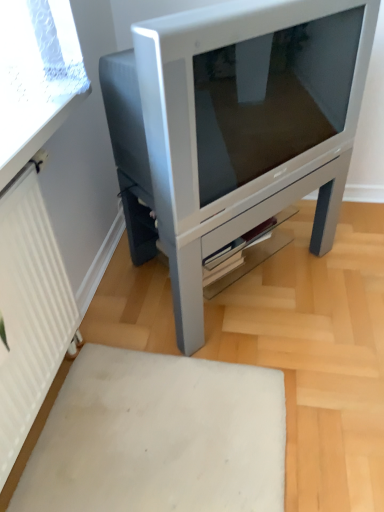
This screenshot has height=512, width=384. Describe the element at coordinates (159, 437) in the screenshot. I see `white matte rug at lower center` at that location.

Identify the location of satin silver television at center. (234, 128).

Is point (111, 121) closer to viewer compared to point (130, 417)?

No, (111, 121) is behind (130, 417).

Which is more to the left, satin silver television at center or white matte rug at lower center?

white matte rug at lower center.

At what (x,y) coordinates should I click in order to perform the action: click on furniture on the right of white matte rug at lower center. Please return your answer as a coordinate pair (x, y). The width and height of the screenshot is (384, 512). Looking at the image, I should click on (234, 128).

Based on the photo, between white ribbed radiator at left and white matte rug at lower center, which one has less height?

white matte rug at lower center is shorter.

Identify the location of plain behind the white ribbed radiator at left. (159, 437).

Does white ribbed radiator at left have a greater width compared to white matte rug at lower center?

No, white ribbed radiator at left is not wider than white matte rug at lower center.

Considering the positions of objects white ribbed radiator at left and white matte rug at lower center in the image provided, who is in front, white ribbed radiator at left or white matte rug at lower center?

white ribbed radiator at left is closer to the camera.

From the image's perspective, does white matte rug at lower center appear lower than white ribbed radiator at left?

Yes, from the image's perspective, white matte rug at lower center is beneath white ribbed radiator at left.

Consider the image. Is white matte rug at lower center taller or shorter than white ribbed radiator at left?

white matte rug at lower center is shorter than white ribbed radiator at left.

Does white matte rug at lower center come in front of white ribbed radiator at left?

No, it is behind white ribbed radiator at left.

From a real-world perspective, which object rests below the other?

In real-world perspective, white matte rug at lower center is lower.

From a real-world perspective, is satin silver television at center above or below white ribbed radiator at left?

satin silver television at center is situated lower than white ribbed radiator at left in the real world.

Considering the relative positions of satin silver television at center and white ribbed radiator at left in the image provided, is satin silver television at center behind white ribbed radiator at left?

Yes, satin silver television at center is further from the viewer.

Is the surface of satin silver television at center in direct contact with white ribbed radiator at left?

Answer: No, satin silver television at center is not next to white ribbed radiator at left.

Considering the sizes of satin silver television at center and white ribbed radiator at left in the image, is satin silver television at center wider or thinner than white ribbed radiator at left?

In the image, satin silver television at center appears to be wider than white ribbed radiator at left.

From a real-world perspective, is white matte rug at lower center beneath satin silver television at center?

Indeed, from a real-world perspective, white matte rug at lower center is positioned beneath satin silver television at center.

Is white matte rug at lower center aimed at satin silver television at center?

No.

From the image's perspective, is white matte rug at lower center located beneath satin silver television at center?

Yes, from the image's perspective, white matte rug at lower center is beneath satin silver television at center.

Considering the relative sizes of white ribbed radiator at left and satin silver television at center in the image provided, is white ribbed radiator at left bigger than satin silver television at center?

Incorrect, white ribbed radiator at left is not larger than satin silver television at center.

Is white ribbed radiator at left far away from satin silver television at center?

Actually, white ribbed radiator at left and satin silver television at center are a little close together.

This screenshot has width=384, height=512. In order to click on furniture that appears on the right of white ribbed radiator at left in this screenshot , I will do `click(234, 128)`.

There is a white matte rug at lower center. Find the location of `furniture above it (from a real-world perspective)`. furniture above it (from a real-world perspective) is located at coordinates (234, 128).

You are a GUI agent. You are given a task and a screenshot of the screen. Output one action in this format:
    pyautogui.click(x=<x>, y=<y>)
    Task: Click on the plain below the white ribbed radiator at left (from a real-world perspective)
    
    Given the screenshot: What is the action you would take?
    click(x=159, y=437)

Considering their positions, is white matte rug at lower center positioned closer to white ribbed radiator at left than satin silver television at center?

white matte rug at lower center is positioned closer to the anchor white ribbed radiator at left.

Looking at the image, which one is located further to white matte rug at lower center, white ribbed radiator at left or satin silver television at center?

Based on the image, satin silver television at center appears to be further to white matte rug at lower center.

Estimate the real-world distances between objects in this image. Which object is closer to white ribbed radiator at left, satin silver television at center or white matte rug at lower center?

white matte rug at lower center is positioned closer to the anchor white ribbed radiator at left.

Based on the photo, looking at the image, which one is located closer to satin silver television at center, white matte rug at lower center or white ribbed radiator at left?

white ribbed radiator at left is positioned closer to the anchor satin silver television at center.

Considering their positions, is white ribbed radiator at left positioned further to satin silver television at center than white matte rug at lower center?

white matte rug at lower center.

Based on their spatial positions, is satin silver television at center or white ribbed radiator at left further from white matte rug at lower center?

satin silver television at center lies further to white matte rug at lower center than the other object.

Locate an element on the screen. Image resolution: width=384 pixels, height=512 pixels. radiator between satin silver television at center and white matte rug at lower center in the vertical direction is located at coordinates (29, 312).